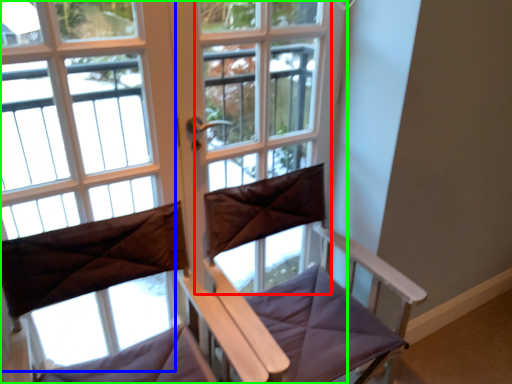
Question: Which is nearer to the screen door (highlighted by a red box)? bay window (highlighted by a blue box) or window (highlighted by a green box).

Choices:
 (A) bay window
 (B) window

Answer: (B)